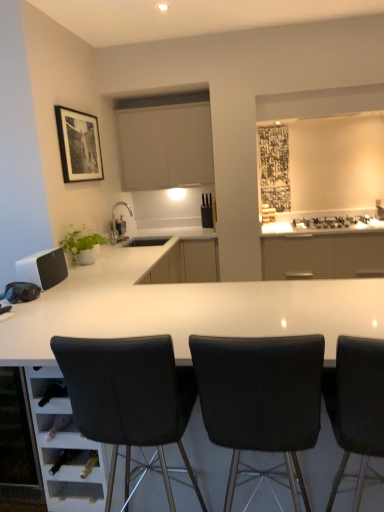
Question: Is point (57, 272) closer or farther from the camera than point (188, 153)?

Choices:
 (A) farther
 (B) closer

Answer: (B)

Question: Is matte black speaker at left spatially inside matte beige cabinet at upper center, or outside of it?

Choices:
 (A) outside
 (B) inside

Answer: (A)

Question: Which object is the closest to the matte black speaker at left?

Choices:
 (A) black leather chair at center, which is the 3th chair in right-to-left order
 (B) black leather chair at center, which is the 1th chair from right to left
 (C) black matte gas stove at upper right
 (D) black fabric chair at center, placed as the 2th chair when sorted from right to left
 (E) black matte picture frame at upper left

Answer: (E)

Question: Based on their relative distances, which object is nearer to the black matte gas stove at upper right?

Choices:
 (A) black leather chair at center, which is the 1th chair from right to left
 (B) matte black speaker at left
 (C) matte beige cabinet at upper center
 (D) black fabric chair at center, placed as the 2th chair when sorted from right to left
 (E) white glossy table at center

Answer: (C)